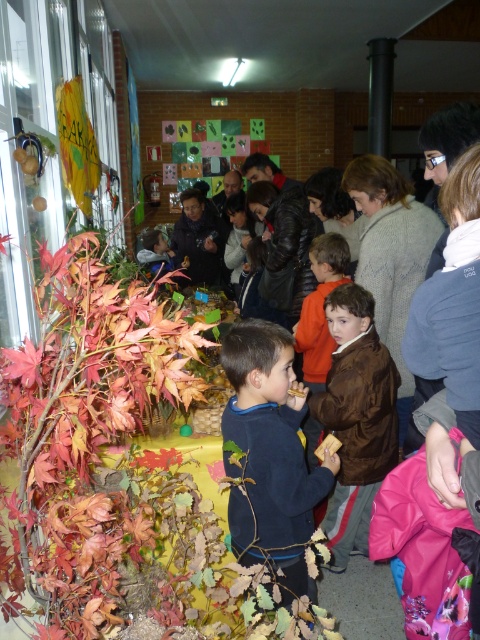
Is point (34, 612) positioned in front of point (347, 388)?

Yes.

Is autumn leaves at left bigger than brown fuzzy jacket at center?

Correct, autumn leaves at left is larger in size than brown fuzzy jacket at center.

Between point (181, 550) and point (364, 360), which one is positioned behind?

Positioned behind is point (364, 360).

Locate an element on the screen. autumn leaves at left is located at coordinates (100, 451).

Is dark blue sweater at center shorter than brown fuzzy jacket at center?

Yes, dark blue sweater at center is shorter than brown fuzzy jacket at center.

Can you confirm if dark blue sweater at center is bigger than brown fuzzy jacket at center?

Actually, dark blue sweater at center might be smaller than brown fuzzy jacket at center.

Which is in front, point (279, 372) or point (364, 490)?

Point (279, 372)

Locate an element on the screen. dark blue sweater at center is located at coordinates (269, 454).

Which is below, autumn leaves at left or dark blue sweater at center?

dark blue sweater at center is lower down.

Which is behind, point (123, 504) or point (250, 433)?

The point (250, 433) is behind.

Find the location of `autumn leaves at left`. autumn leaves at left is located at coordinates (100, 451).

Identify the location of autumn leaves at left. (100, 451).